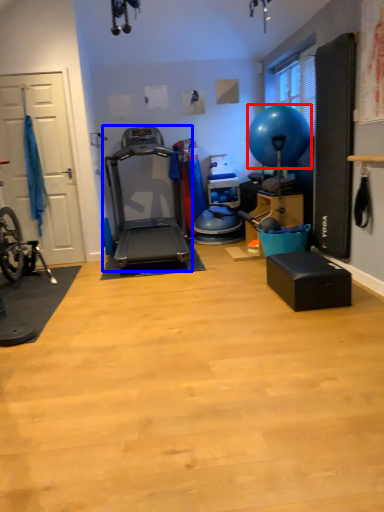
Question: Which object is further to the camera taking this photo, balloon (highlighted by a red box) or treadmill (highlighted by a blue box)?

Choices:
 (A) balloon
 (B) treadmill

Answer: (A)